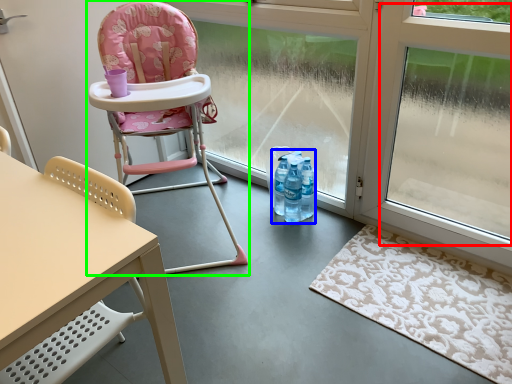
Question: Estimate the real-world distances between objects in this image. Which object is farther from window screen (highlighted by a red box), bottle (highlighted by a blue box) or chair (highlighted by a green box)?

Choices:
 (A) bottle
 (B) chair

Answer: (B)